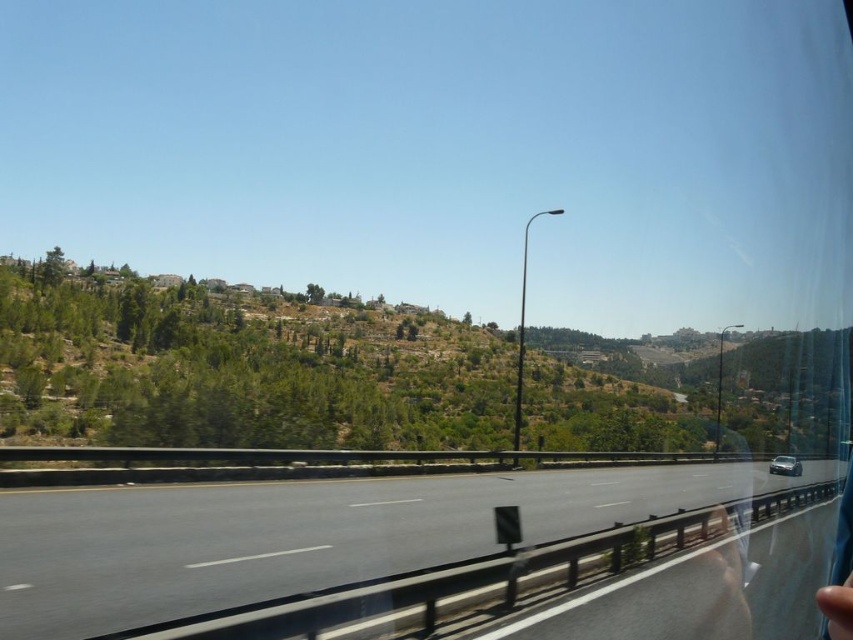
Which is in front, point (28, 536) or point (793, 472)?

Point (28, 536)

In order to click on black asphalt highway at center in this screenshot , I will do `click(297, 532)`.

Locate an element on the screen. The height and width of the screenshot is (640, 853). black asphalt highway at center is located at coordinates (297, 532).